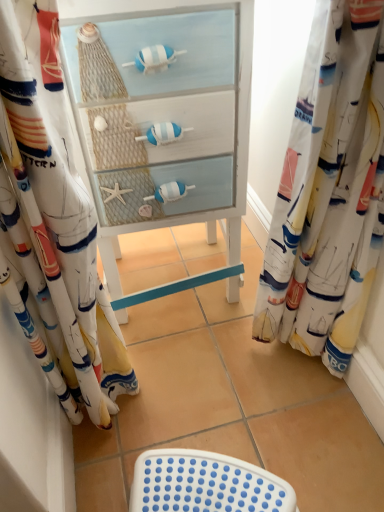
Question: Does white sailboat-patterned fabric at left, the 2th curtain when ordered from right to left, have a lesser height compared to white painted wood cabinet at center?

Choices:
 (A) yes
 (B) no

Answer: (B)

Question: Is white sailboat-patterned fabric at left, the 2th curtain when ordered from right to left, beside white painted wood cabinet at center?

Choices:
 (A) yes
 (B) no

Answer: (B)

Question: Considering the relative positions of white sailboat-patterned fabric at left, the 2th curtain when ordered from right to left, and white painted wood cabinet at center in the image provided, is white sailboat-patterned fabric at left, the 2th curtain when ordered from right to left, in front of white painted wood cabinet at center?

Choices:
 (A) yes
 (B) no

Answer: (A)

Question: Can you confirm if white sailboat-patterned fabric at left, the 2th curtain when ordered from right to left, is bigger than white painted wood cabinet at center?

Choices:
 (A) no
 (B) yes

Answer: (A)

Question: Are white sailboat-patterned fabric at left, the 2th curtain when ordered from right to left, and white painted wood cabinet at center located far from each other?

Choices:
 (A) yes
 (B) no

Answer: (B)

Question: Considering the relative positions of white sailboat-patterned fabric at left, the 2th curtain when ordered from right to left, and white painted wood cabinet at center in the image provided, is white sailboat-patterned fabric at left, the 2th curtain when ordered from right to left, to the right of white painted wood cabinet at center from the viewer's perspective?

Choices:
 (A) no
 (B) yes

Answer: (A)

Question: From a real-world perspective, is white sailboat-patterned fabric at left, the 2th curtain when ordered from right to left, on white plastic stool at lower center?

Choices:
 (A) no
 (B) yes

Answer: (B)

Question: Would you say white sailboat-patterned fabric at left, the 2th curtain when ordered from right to left, is outside white plastic stool at lower center?

Choices:
 (A) no
 (B) yes

Answer: (B)

Question: Is white sailboat-patterned fabric at left, the 2th curtain when ordered from right to left, next to white plastic stool at lower center and touching it?

Choices:
 (A) yes
 (B) no

Answer: (B)

Question: Is white plastic stool at lower center a part of white sailboat-patterned fabric at left, the 2th curtain when ordered from right to left?

Choices:
 (A) no
 (B) yes

Answer: (A)

Question: From a real-world perspective, is white sailboat-patterned fabric at left, which appears as the first curtain when viewed from the left, located beneath white plastic stool at lower center?

Choices:
 (A) yes
 (B) no

Answer: (B)

Question: Can you confirm if white sailboat-patterned fabric at left, which appears as the first curtain when viewed from the left, is thinner than white plastic stool at lower center?

Choices:
 (A) no
 (B) yes

Answer: (A)

Question: Considering the relative positions of white painted wood cabinet at center and white sailboat-patterned fabric at left, the 2th curtain when ordered from right to left, in the image provided, is white painted wood cabinet at center in front of white sailboat-patterned fabric at left, the 2th curtain when ordered from right to left,?

Choices:
 (A) yes
 (B) no

Answer: (B)